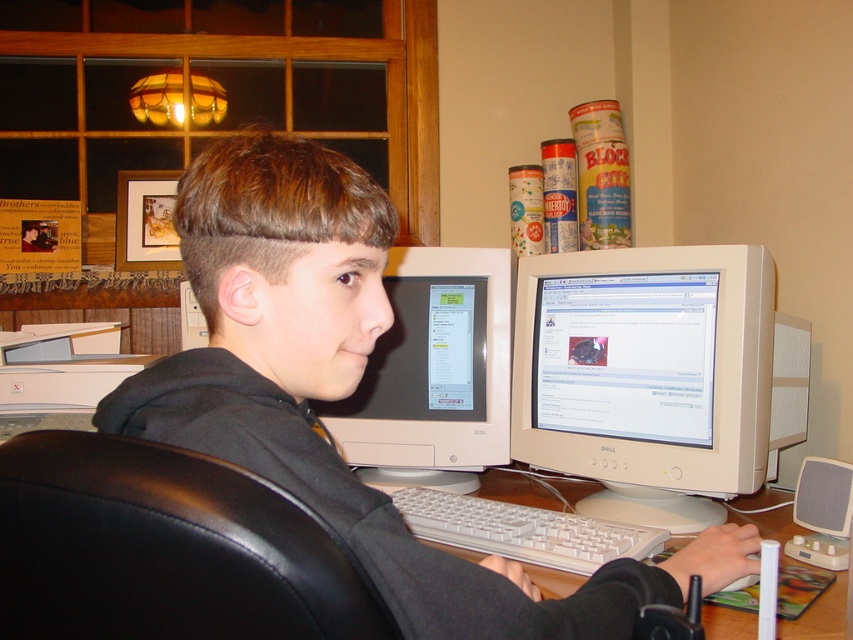
You are organizing a desk space and need to place a new item between the matte black hoodie at center and the white plastic keyboard at center. Which object should you move to make space?

The matte black hoodie at center is larger in size than the white plastic keyboard at center, so you should move the matte black hoodie at center to make space for the new item.

You are organizing a workspace and need to place a new laptop. Considering the white plastic keyboard at center and the wooden desk at center, which object has more space available for placing the laptop?

The wooden desk at center has more space available for placing the laptop since it occupies more space than the white plastic keyboard at center.

From the picture: You are a delivery person who needs to place a small package on the desk without blocking the keyboard. The desk has a matte black hoodie at center and a white plastic keyboard at center. Where should you place the package to avoid covering the keyboard?

The matte black hoodie at center is located above the white plastic keyboard at center, so placing the package below the hoodie at center but above the edge of the desk would avoid covering the keyboard.